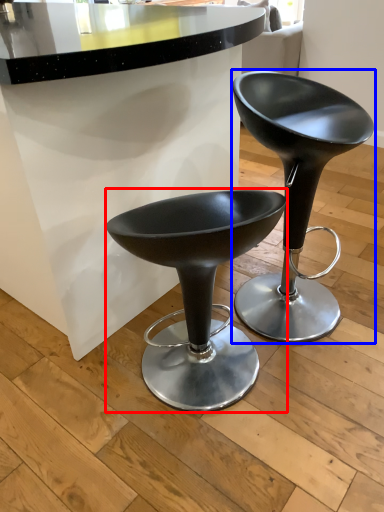
Question: Which object is closer to the camera taking this photo, stool (highlighted by a red box) or stool (highlighted by a blue box)?

Choices:
 (A) stool
 (B) stool

Answer: (A)